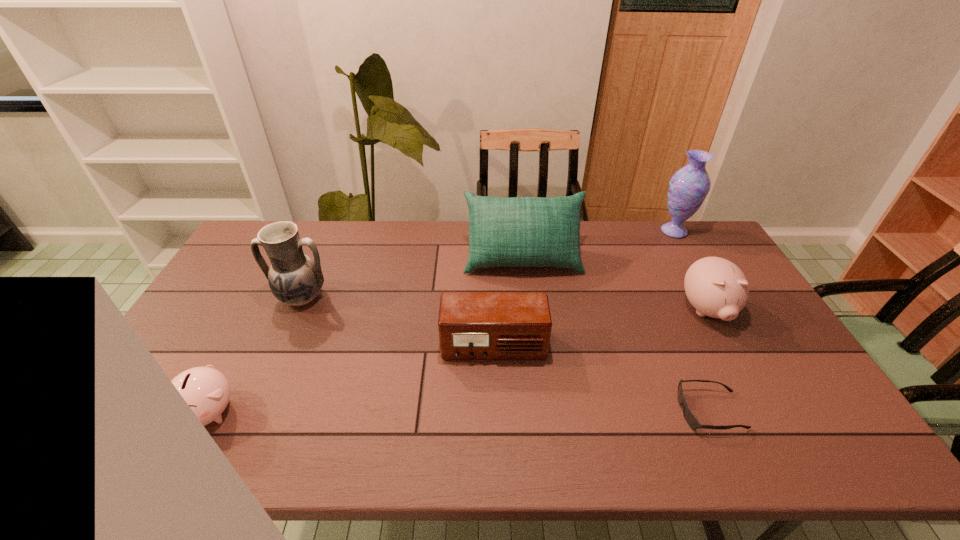
The image size is (960, 540). In order to click on vase in this screenshot , I will do `click(688, 188)`.

Locate an element on the screen. pitcher is located at coordinates (294, 278).

Where is `cushion`? This screenshot has height=540, width=960. cushion is located at coordinates (519, 231).

Locate an element on the screen. the farther piggy bank is located at coordinates (716, 287).

This screenshot has width=960, height=540. I want to click on the taller piggy bank, so click(x=716, y=287).

The image size is (960, 540). In order to click on radio receiver in this screenshot , I will do `click(472, 325)`.

At what (x,y) coordinates should I click in order to perform the action: click on the left piggy bank. Please return your answer as a coordinate pair (x, y). The height and width of the screenshot is (540, 960). Looking at the image, I should click on 206,390.

At what (x,y) coordinates should I click in order to perform the action: click on the nearer piggy bank. Please return your answer as a coordinate pair (x, y). The height and width of the screenshot is (540, 960). Looking at the image, I should click on (206, 390).

In order to click on sunglasses in this screenshot , I will do `click(689, 417)`.

The height and width of the screenshot is (540, 960). Identify the location of free location located on the left of the tallest object. click(x=550, y=231).